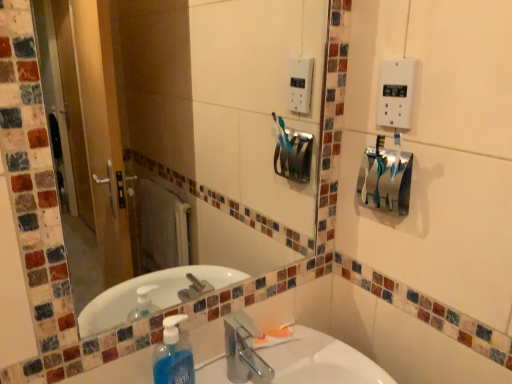
Question: Can you confirm if white plastic light switch at upper right is wider than clear glass mirror at upper center?

Choices:
 (A) yes
 (B) no

Answer: (B)

Question: Is white plastic light switch at upper right at the right side of clear glass mirror at upper center?

Choices:
 (A) no
 (B) yes

Answer: (B)

Question: Does white plastic light switch at upper right come behind clear glass mirror at upper center?

Choices:
 (A) no
 (B) yes

Answer: (B)

Question: Is white plastic light switch at upper right aimed at clear glass mirror at upper center?

Choices:
 (A) yes
 (B) no

Answer: (A)

Question: Is white plastic light switch at upper right in contact with clear glass mirror at upper center?

Choices:
 (A) yes
 (B) no

Answer: (B)

Question: Can you confirm if white plastic light switch at upper right is positioned to the left of clear glass mirror at upper center?

Choices:
 (A) no
 (B) yes

Answer: (A)

Question: From the image's perspective, is clear glass mirror at upper center located above white glossy sink at lower center?

Choices:
 (A) yes
 (B) no

Answer: (A)

Question: Does clear glass mirror at upper center have a lesser height compared to white glossy sink at lower center?

Choices:
 (A) yes
 (B) no

Answer: (B)

Question: Is clear glass mirror at upper center at the left side of white glossy sink at lower center?

Choices:
 (A) yes
 (B) no

Answer: (A)

Question: From a real-world perspective, is clear glass mirror at upper center over white glossy sink at lower center?

Choices:
 (A) yes
 (B) no

Answer: (A)

Question: Is the depth of clear glass mirror at upper center greater than that of white glossy sink at lower center?

Choices:
 (A) yes
 (B) no

Answer: (A)

Question: Can you confirm if clear glass mirror at upper center is taller than white glossy sink at lower center?

Choices:
 (A) yes
 (B) no

Answer: (A)

Question: Can you confirm if white glossy sink at lower center is wider than translucent orange tube at sink?

Choices:
 (A) no
 (B) yes

Answer: (B)